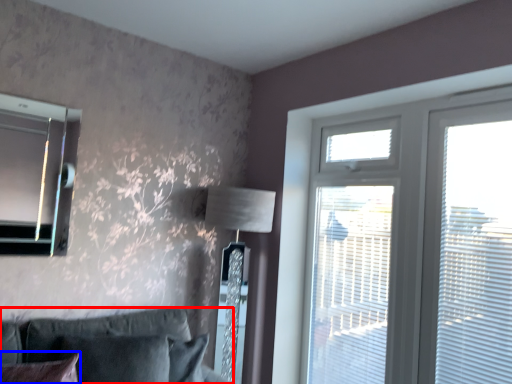
Question: Which of the following is the closest to the observer, studio couch (highlighted by a red box) or pillow (highlighted by a blue box)?

Choices:
 (A) studio couch
 (B) pillow

Answer: (B)